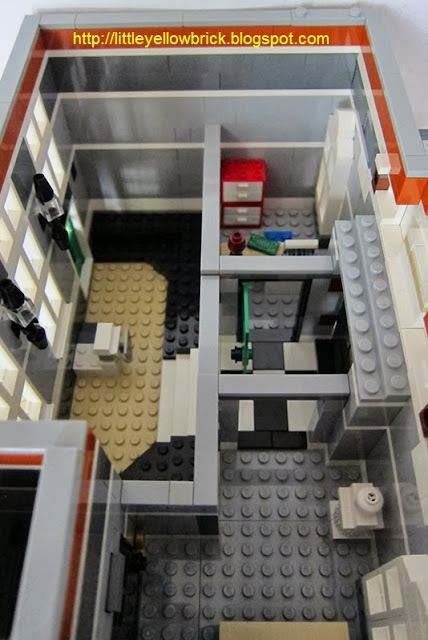
The height and width of the screenshot is (640, 428). What are the coordinates of `gray floor in foreground` in the screenshot? It's located at (266, 525).